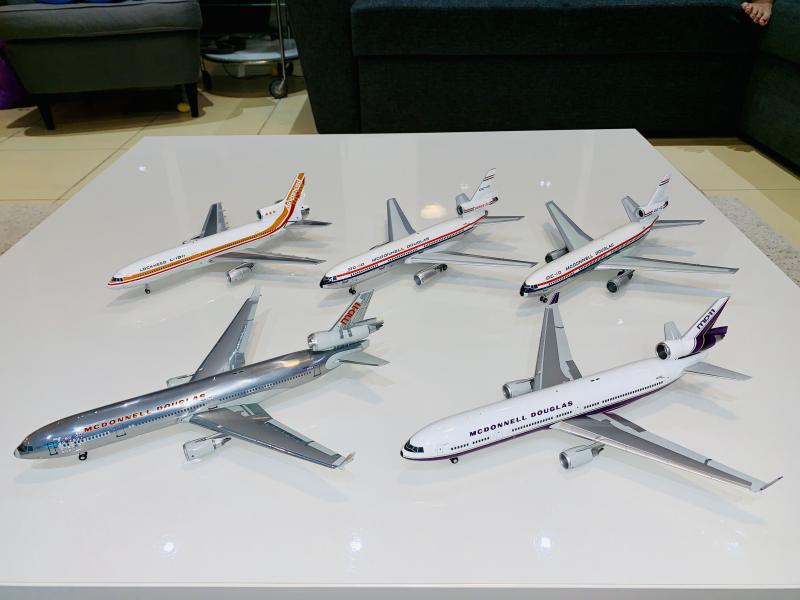
What are the coordinates of `couch` in the screenshot? It's located at (693, 46), (86, 49).